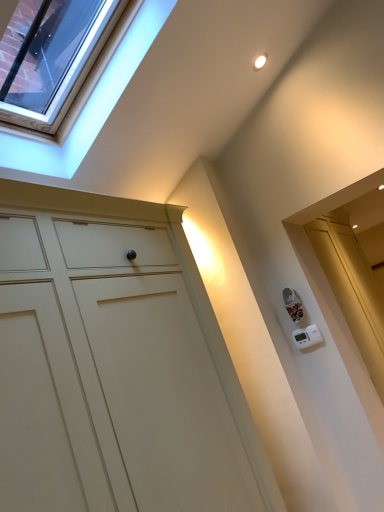
Question: Can you confirm if clear glass window at upper left is positioned to the right of matte white cupboard at center?

Choices:
 (A) no
 (B) yes

Answer: (A)

Question: Does clear glass window at upper left have a lesser width compared to matte white cupboard at center?

Choices:
 (A) no
 (B) yes

Answer: (B)

Question: Is clear glass window at upper left smaller than matte white cupboard at center?

Choices:
 (A) no
 (B) yes

Answer: (B)

Question: Is clear glass window at upper left next to matte white cupboard at center and touching it?

Choices:
 (A) no
 (B) yes

Answer: (A)

Question: Does clear glass window at upper left have a larger size compared to matte white cupboard at center?

Choices:
 (A) yes
 (B) no

Answer: (B)

Question: Are clear glass window at upper left and matte white cupboard at center located far from each other?

Choices:
 (A) yes
 (B) no

Answer: (A)

Question: Could you tell me if matte white cupboard at center is turned towards clear glass window at upper left?

Choices:
 (A) yes
 (B) no

Answer: (B)

Question: Is matte white cupboard at center to the right of clear glass window at upper left from the viewer's perspective?

Choices:
 (A) yes
 (B) no

Answer: (A)

Question: From the image's perspective, would you say matte white cupboard at center is shown under clear glass window at upper left?

Choices:
 (A) yes
 (B) no

Answer: (A)

Question: Does matte white cupboard at center have a greater height compared to clear glass window at upper left?

Choices:
 (A) yes
 (B) no

Answer: (A)

Question: Is matte white cupboard at center bigger than clear glass window at upper left?

Choices:
 (A) no
 (B) yes

Answer: (B)

Question: From a real-world perspective, is matte white cupboard at center located beneath clear glass window at upper left?

Choices:
 (A) yes
 (B) no

Answer: (A)

Question: In the image, is matte white cupboard at center on the left side or the right side of clear glass window at upper left?

Choices:
 (A) left
 (B) right

Answer: (B)